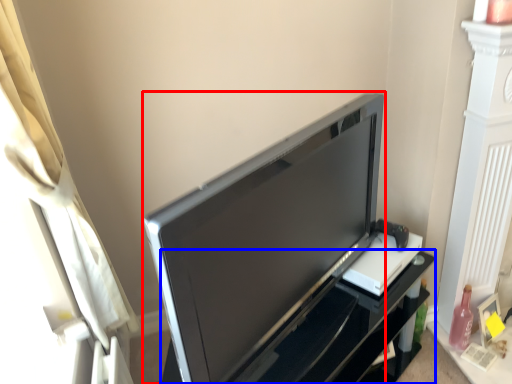
Question: Among these objects, which one is nearest to the camera, television (highlighted by a red box) or furniture (highlighted by a blue box)?

Choices:
 (A) television
 (B) furniture

Answer: (A)